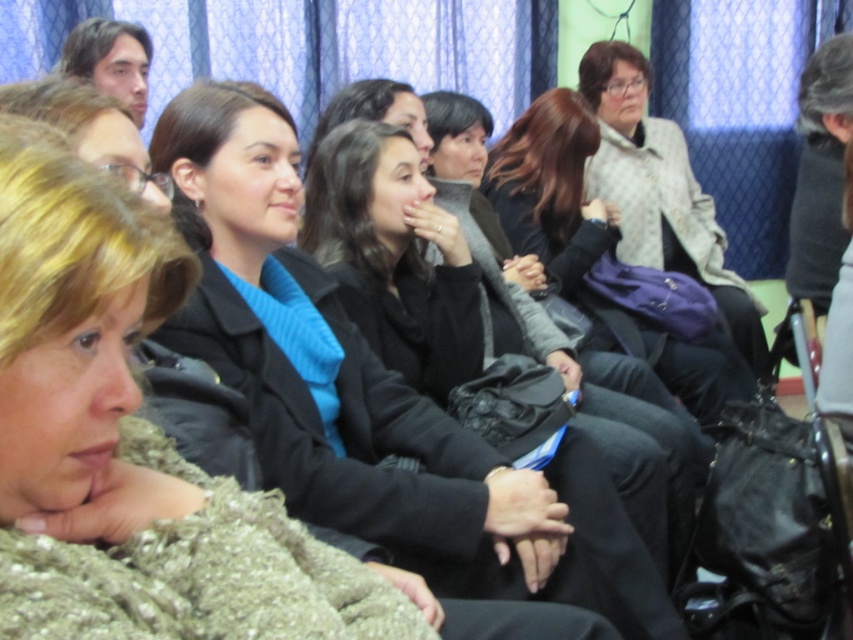
Question: Which point is closer to the camera?

Choices:
 (A) (532, 100)
 (B) (436, 516)
 (C) (531, 259)

Answer: (B)

Question: Can you confirm if blue woolen sweater at center is positioned to the right of matte black bag at center?

Choices:
 (A) no
 (B) yes

Answer: (A)

Question: Does blue woolen sweater at center appear under knitted wool scarf at center?

Choices:
 (A) no
 (B) yes

Answer: (A)

Question: Does blue woolen sweater at center appear over knitted wool scarf at center?

Choices:
 (A) no
 (B) yes

Answer: (B)

Question: Which object is positioned closest to the black leather jacket at center?

Choices:
 (A) blue woolen sweater at center
 (B) knitted wool scarf at center

Answer: (A)

Question: Which of the following is the farthest from the observer?

Choices:
 (A) (158, 228)
 (B) (735, 378)
 (C) (384, 381)
 (D) (621, 387)

Answer: (B)